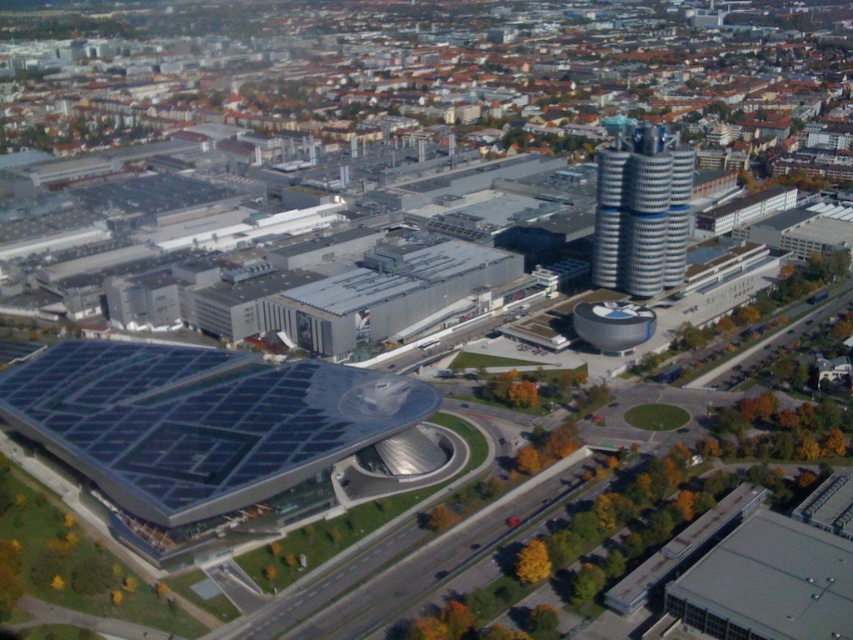
Which is behind, point (308, 372) or point (630, 212)?

The point (630, 212) is behind.

What do you see at coordinates (200, 420) in the screenshot? I see `transparent glass roof at lower left` at bounding box center [200, 420].

You are a GUI agent. You are given a task and a screenshot of the screen. Output one action in this format:
    pyautogui.click(x=<x>, y=<y>)
    Task: Click on the transparent glass roof at lower left
    This screenshot has width=853, height=640.
    Given the screenshot: What is the action you would take?
    pyautogui.click(x=200, y=420)